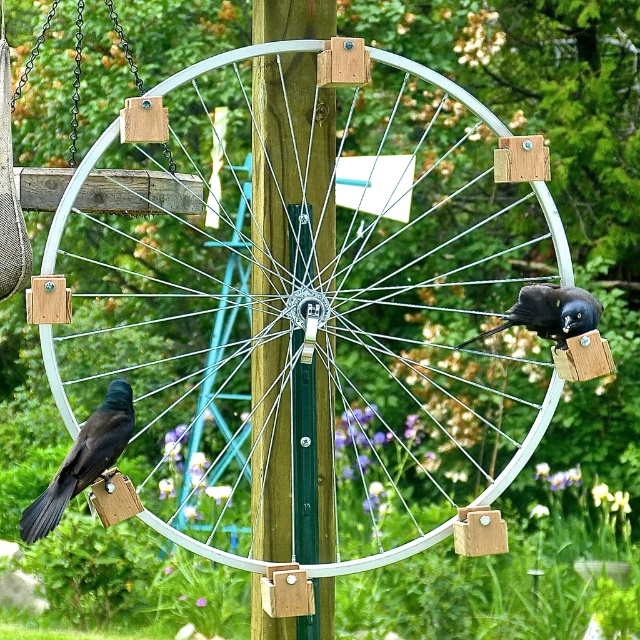
The height and width of the screenshot is (640, 640). What do you see at coordinates (289, 176) in the screenshot?
I see `green wood pole at center` at bounding box center [289, 176].

Is point (310, 10) farther from camera compared to point (557, 326)?

That is True.

Image resolution: width=640 pixels, height=640 pixels. What are the coordinates of `green wood pole at center` in the screenshot? It's located at (289, 176).

Looking at this image, does white metallic wagon wheel at center have a greater width compared to shiny black bird at upper right?

Correct, the width of white metallic wagon wheel at center exceeds that of shiny black bird at upper right.

Between white metallic wagon wheel at center and shiny black bird at upper right, which one has more height?

white metallic wagon wheel at center

Locate an element on the screen. white metallic wagon wheel at center is located at coordinates (314, 308).

Identify the location of white metallic wagon wheel at center. This screenshot has height=640, width=640. (314, 308).

Does green wood pole at center appear under shiny black bird at left?

Incorrect, green wood pole at center is not positioned below shiny black bird at left.

Between point (305, 412) and point (42, 522), which one is positioned in front?

Point (42, 522) is more forward.

Is point (324, 163) closer to camera compared to point (58, 497)?

No.

Identify the location of green wood pole at center. (289, 176).